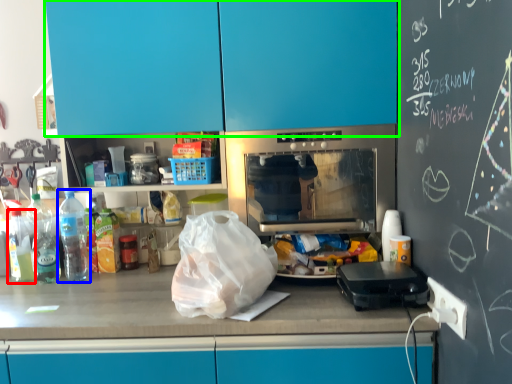
Question: Which object is positioned closest to bottle (highlighted by a red box)? Select from bottle (highlighted by a blue box) and cabinetry (highlighted by a green box).

Choices:
 (A) bottle
 (B) cabinetry

Answer: (A)